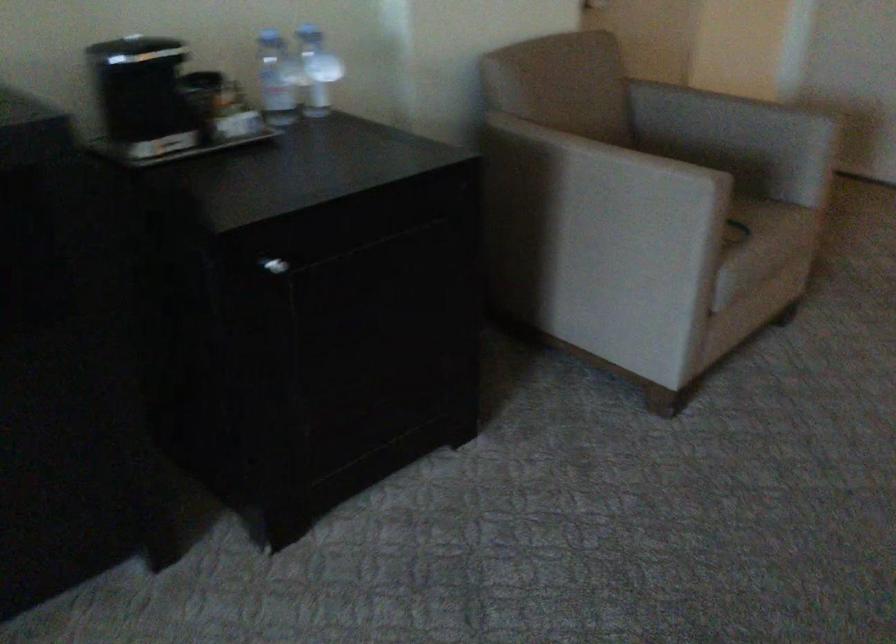
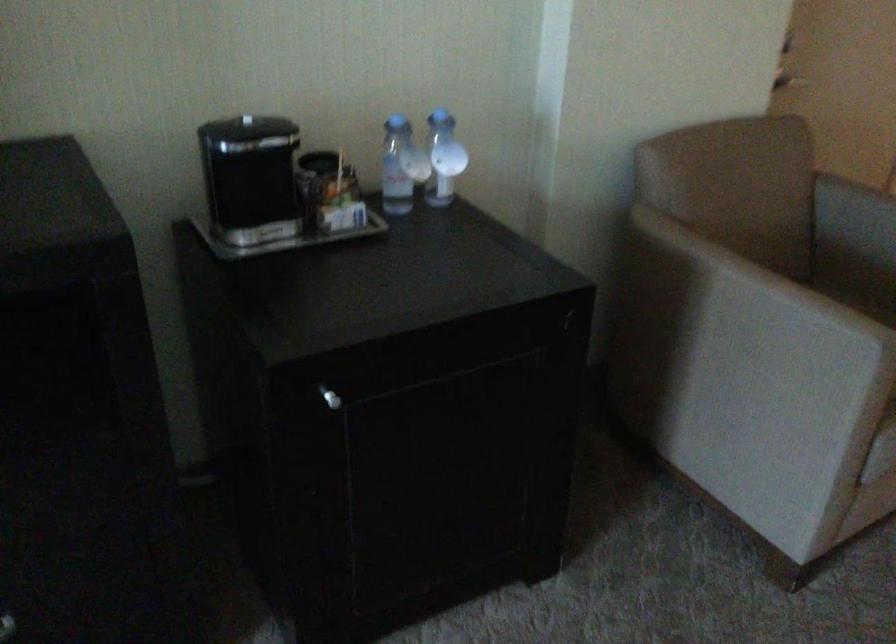
Locate, in the second image, the point that corresponds to [286,76] in the first image.

(401, 166)